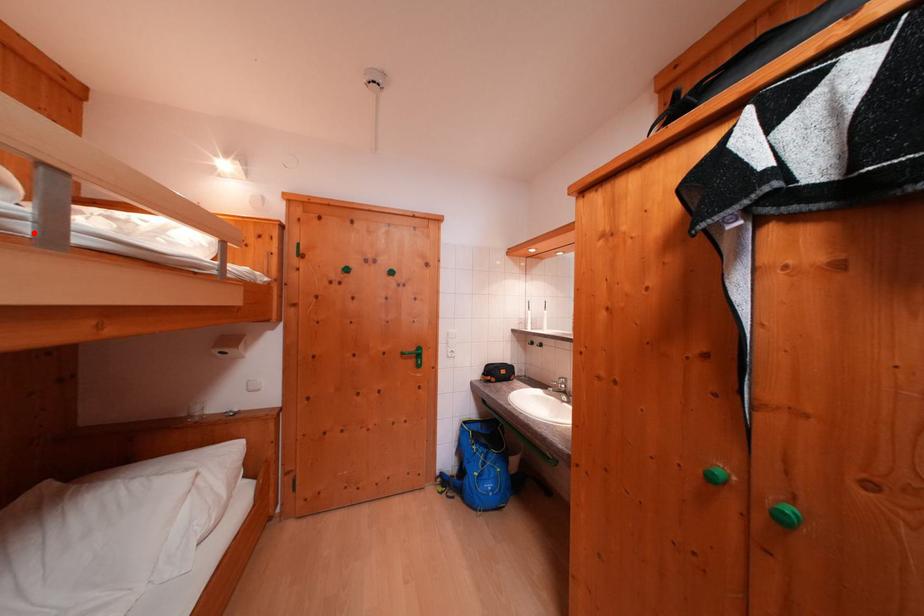
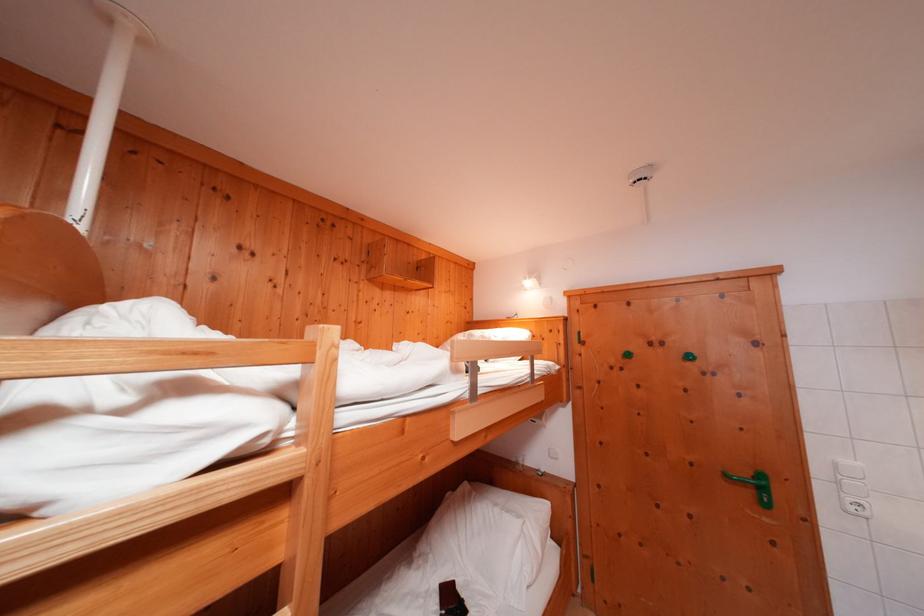
The point at the highlighted location is marked in the first image. Where is the corresponding point in the second image?

(476, 399)